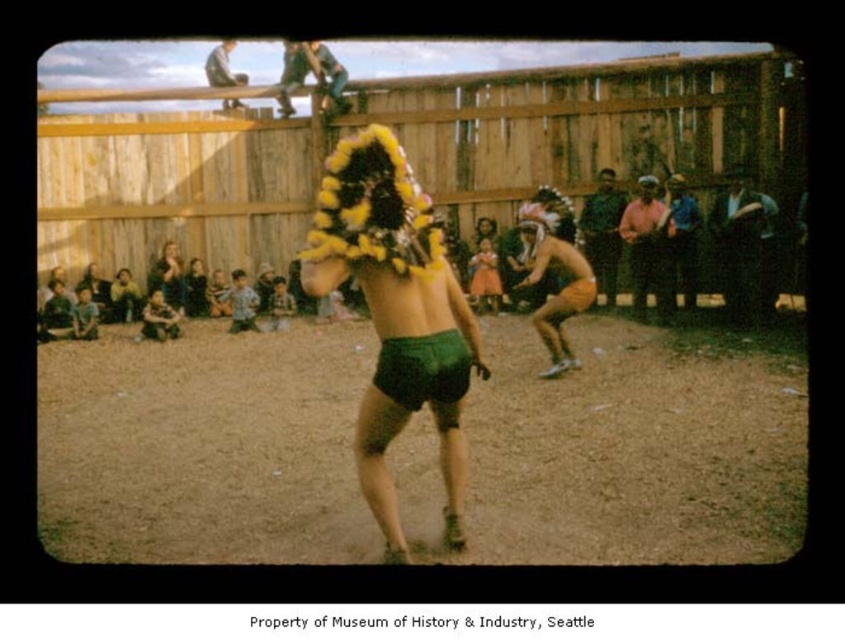
Does dark brown leather jacket at right have a lesser height compared to matte brown skin at center?

In fact, dark brown leather jacket at right may be taller than matte brown skin at center.

Who is taller, dark brown leather jacket at right or matte brown skin at center?

dark brown leather jacket at right is taller.

Does point (740, 198) come in front of point (522, 243)?

Yes, it is in front of point (522, 243).

Locate an element on the screen. The width and height of the screenshot is (845, 640). dark brown leather jacket at right is located at coordinates (742, 244).

Consider the image. Is green fabric headdress at center shorter than matte black headdress at upper center?

No, green fabric headdress at center is not shorter than matte black headdress at upper center.

Is green fabric headdress at center positioned behind matte black headdress at upper center?

No, green fabric headdress at center is closer to the viewer.

Between point (613, 292) and point (222, 106), which one is positioned behind?

Point (222, 106)

I want to click on green fabric headdress at center, so click(603, 230).

Does shiny metallic helmet at upper center appear on the left side of matte black dress at lower left?

No, shiny metallic helmet at upper center is not to the left of matte black dress at lower left.

Can you confirm if shiny metallic helmet at upper center is thinner than matte black dress at lower left?

In fact, shiny metallic helmet at upper center might be wider than matte black dress at lower left.

Which is behind, point (345, 83) or point (200, 289)?

The point (200, 289) is behind.

Where is `shiny metallic helmet at upper center`? This screenshot has width=845, height=640. shiny metallic helmet at upper center is located at coordinates (326, 74).